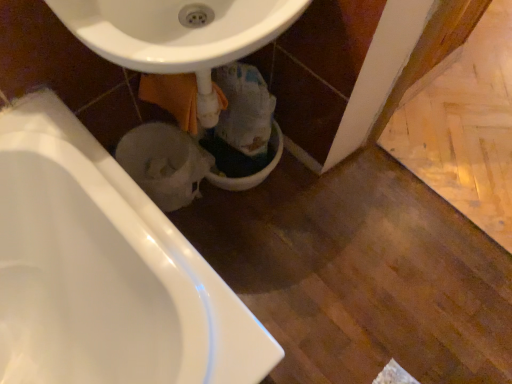
Where is `vacant space situated above white glossy toilet bowl at center, the 1th toilet bowl in the right-to-left sequence (from a real-world perspective)`? vacant space situated above white glossy toilet bowl at center, the 1th toilet bowl in the right-to-left sequence (from a real-world perspective) is located at coordinates (248, 151).